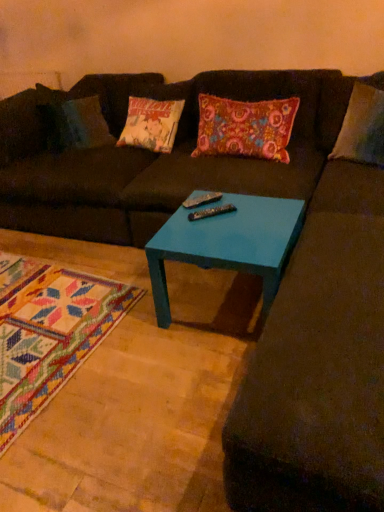
At what (x,y) coordinates should I click in order to perform the action: click on teal glossy table at center. Please return your answer as a coordinate pair (x, y). Looking at the image, I should click on (227, 244).

The image size is (384, 512). I want to click on black plastic remote at center, the first remote in the front-to-back sequence, so click(x=211, y=212).

What is the approximate height of metallic silver remote at center, the first remote positioned from the back?

The height of metallic silver remote at center, the first remote positioned from the back, is 1.43 inches.

In order to click on teal glossy table at center in this screenshot , I will do pos(227,244).

Which is correct: matte brown futon at center is inside black plastic remote at center, the first remote in the front-to-back sequence, or outside of it?

matte brown futon at center is located beyond the bounds of black plastic remote at center, the first remote in the front-to-back sequence.

Considering the relative sizes of matte brown futon at center and black plastic remote at center, the first remote in the front-to-back sequence, in the image provided, is matte brown futon at center thinner than black plastic remote at center, the first remote in the front-to-back sequence,?

No, matte brown futon at center is not thinner than black plastic remote at center, the first remote in the front-to-back sequence.

Where is `futon below the black plastic remote at center, the second remote when ordered from back to front (from a real-world perspective)`? futon below the black plastic remote at center, the second remote when ordered from back to front (from a real-world perspective) is located at coordinates (154, 154).

From the image's perspective, would you say matte brown futon at center is positioned over black plastic remote at center, the second remote when ordered from back to front?

Yes.

Is black plastic remote at center, the first remote in the front-to-back sequence, aimed at floral fabric pillow at center?

No, black plastic remote at center, the first remote in the front-to-back sequence, is not facing towards floral fabric pillow at center.

From a real-world perspective, who is located higher, black plastic remote at center, the first remote in the front-to-back sequence, or floral fabric pillow at center?

In real-world perspective, floral fabric pillow at center is above.

Between black plastic remote at center, the first remote in the front-to-back sequence, and floral fabric pillow at center, which one has smaller size?

With smaller size is black plastic remote at center, the first remote in the front-to-back sequence.

What's the angular difference between teal glossy table at center and metallic silver remote at center, which appears as the 2th remote when viewed from the front,'s facing directions?

48.1 degrees separate the facing orientations of teal glossy table at center and metallic silver remote at center, which appears as the 2th remote when viewed from the front.

Does teal glossy table at center have a greater height compared to metallic silver remote at center, the first remote positioned from the back?

Yes, teal glossy table at center is taller than metallic silver remote at center, the first remote positioned from the back.

In the scene shown: Is the surface of teal glossy table at center in direct contact with metallic silver remote at center, the first remote positioned from the back?

No, teal glossy table at center is not making contact with metallic silver remote at center, the first remote positioned from the back.

From a real-world perspective, is teal glossy table at center on metallic silver remote at center, which appears as the 2th remote when viewed from the front?

Incorrect, from a real-world perspective, teal glossy table at center is lower than metallic silver remote at center, which appears as the 2th remote when viewed from the front.

Is point (189, 219) farther from camera compared to point (195, 197)?

That is False.

Considering the relative sizes of black plastic remote at center, the first remote in the front-to-back sequence, and metallic silver remote at center, which appears as the 2th remote when viewed from the front, in the image provided, is black plastic remote at center, the first remote in the front-to-back sequence, taller than metallic silver remote at center, which appears as the 2th remote when viewed from the front,?

Incorrect, the height of black plastic remote at center, the first remote in the front-to-back sequence, is not larger of that of metallic silver remote at center, which appears as the 2th remote when viewed from the front.

Is black plastic remote at center, the second remote when ordered from back to front, bigger than metallic silver remote at center, which appears as the 2th remote when viewed from the front?

No, black plastic remote at center, the second remote when ordered from back to front, is not bigger than metallic silver remote at center, which appears as the 2th remote when viewed from the front.

Which is in front, floral fabric pillow at center or teal glossy table at center?

teal glossy table at center is more forward.

Is floral fabric pillow at center next to teal glossy table at center?

No, floral fabric pillow at center is not touching teal glossy table at center.

Based on the photo, from a real-world perspective, is floral fabric pillow at center located higher than teal glossy table at center?

Indeed, from a real-world perspective, floral fabric pillow at center stands above teal glossy table at center.

Based on the photo, from the image's perspective, would you say matte brown futon at center is positioned over metallic silver remote at center, the first remote positioned from the back?

Yes, from the image's perspective, matte brown futon at center is above metallic silver remote at center, the first remote positioned from the back.

Is matte brown futon at center closer to camera compared to metallic silver remote at center, which appears as the 2th remote when viewed from the front?

Yes, it is in front of metallic silver remote at center, which appears as the 2th remote when viewed from the front.

Considering the sizes of objects matte brown futon at center and metallic silver remote at center, which appears as the 2th remote when viewed from the front, in the image provided, who is thinner, matte brown futon at center or metallic silver remote at center, which appears as the 2th remote when viewed from the front,?

metallic silver remote at center, which appears as the 2th remote when viewed from the front.

The height and width of the screenshot is (512, 384). Identify the location of futon located on the left of metallic silver remote at center, which appears as the 2th remote when viewed from the front. (154, 154).

Does floral fabric pillow at center have a lesser width compared to metallic silver remote at center, which appears as the 2th remote when viewed from the front?

No.

Would you consider floral fabric pillow at center to be distant from metallic silver remote at center, the first remote positioned from the back?

No, floral fabric pillow at center is not far from metallic silver remote at center, the first remote positioned from the back.

Based on the photo, who is more distant, floral fabric pillow at center or metallic silver remote at center, which appears as the 2th remote when viewed from the front?

Positioned behind is floral fabric pillow at center.

Is floral fabric pillow at center shorter than metallic silver remote at center, which appears as the 2th remote when viewed from the front?

No.

Locate an element on the screen. This screenshot has width=384, height=512. futon below the black plastic remote at center, the first remote in the front-to-back sequence (from a real-world perspective) is located at coordinates [x=154, y=154].

Locate an element on the screen. This screenshot has height=512, width=384. throw pillow that is behind the black plastic remote at center, the first remote in the front-to-back sequence is located at coordinates (245, 127).

When comparing their distances from matte brown futon at center, does floral fabric pillow at center or teal glossy table at center seem closer?

The object closer to matte brown futon at center is floral fabric pillow at center.

Looking at the image, which one is located further to metallic silver remote at center, the first remote positioned from the back, floral fabric pillow at center or matte brown futon at center?

matte brown futon at center is further to metallic silver remote at center, the first remote positioned from the back.

Estimate the real-world distances between objects in this image. Which object is closer to matte brown futon at center, metallic silver remote at center, the first remote positioned from the back, or floral fabric pillow at center?

floral fabric pillow at center lies closer to matte brown futon at center than the other object.

Based on their spatial positions, is matte brown futon at center or metallic silver remote at center, which appears as the 2th remote when viewed from the front, closer to floral fabric pillow at center?

matte brown futon at center is closer to floral fabric pillow at center.

Estimate the real-world distances between objects in this image. Which object is closer to black plastic remote at center, the second remote when ordered from back to front, teal glossy table at center or floral fabric pillow at center?

teal glossy table at center.

Based on their spatial positions, is floral fabric pillow at center or metallic silver remote at center, the first remote positioned from the back, closer to teal glossy table at center?

metallic silver remote at center, the first remote positioned from the back, is closer to teal glossy table at center.

Estimate the real-world distances between objects in this image. Which object is closer to black plastic remote at center, the first remote in the front-to-back sequence, metallic silver remote at center, the first remote positioned from the back, or matte brown futon at center?

metallic silver remote at center, the first remote positioned from the back, lies closer to black plastic remote at center, the first remote in the front-to-back sequence, than the other object.

Which object lies nearer to the anchor point metallic silver remote at center, the first remote positioned from the back, teal glossy table at center or floral fabric pillow at center?

Based on the image, teal glossy table at center appears to be nearer to metallic silver remote at center, the first remote positioned from the back.

Image resolution: width=384 pixels, height=512 pixels. What are the coordinates of `remote between matte brown futon at center and black plastic remote at center, the first remote in the front-to-back sequence, in the vertical direction` in the screenshot? It's located at (202, 200).

Identify the location of remote located between teal glossy table at center and metallic silver remote at center, the first remote positioned from the back, in the depth direction. (211, 212).

This screenshot has height=512, width=384. Find the location of `remote that lies between floral fabric pillow at center and black plastic remote at center, the second remote when ordered from back to front, from top to bottom`. remote that lies between floral fabric pillow at center and black plastic remote at center, the second remote when ordered from back to front, from top to bottom is located at coordinates (202, 200).

What are the coordinates of `futon that lies between floral fabric pillow at center and black plastic remote at center, the second remote when ordered from back to front, from top to bottom` in the screenshot? It's located at (154, 154).